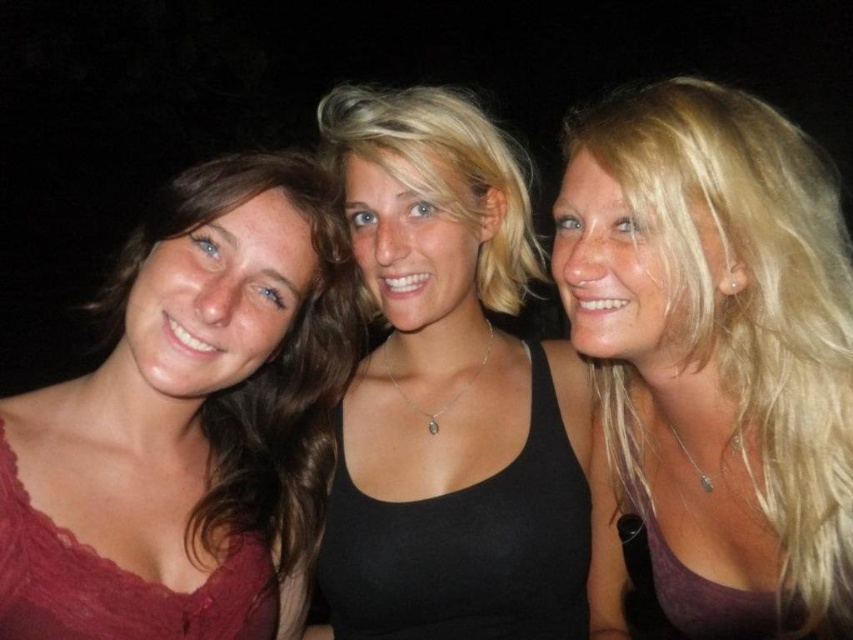
Question: Where is blonde hair at center located in relation to black matte tank top at center in the image?

Choices:
 (A) right
 (B) left

Answer: (A)

Question: Can you confirm if black matte tank top at center is smaller than matte red dress at left?

Choices:
 (A) yes
 (B) no

Answer: (B)

Question: Among these points, which one is farthest from the camera?

Choices:
 (A) (357, 108)
 (B) (218, 284)
 (C) (648, 189)

Answer: (A)

Question: Which of the following is the farthest from the observer?

Choices:
 (A) (538, 260)
 (B) (329, 337)
 (C) (657, 419)

Answer: (A)

Question: Can you confirm if blonde hair at center is positioned to the right of black matte tank top at center?

Choices:
 (A) no
 (B) yes

Answer: (B)

Question: Estimate the real-world distances between objects in this image. Which object is farther from the blonde hair at center?

Choices:
 (A) matte red dress at left
 (B) black matte tank top at center

Answer: (A)